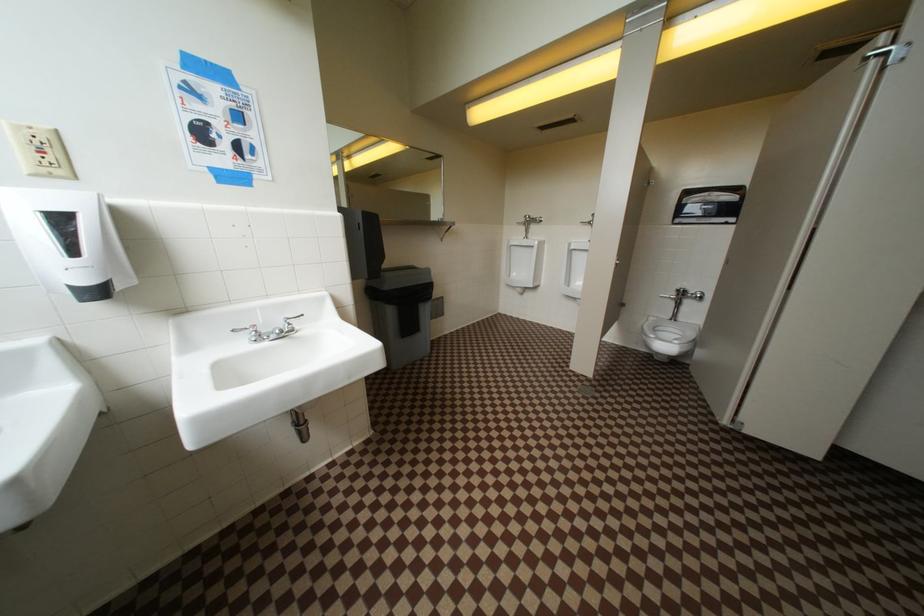
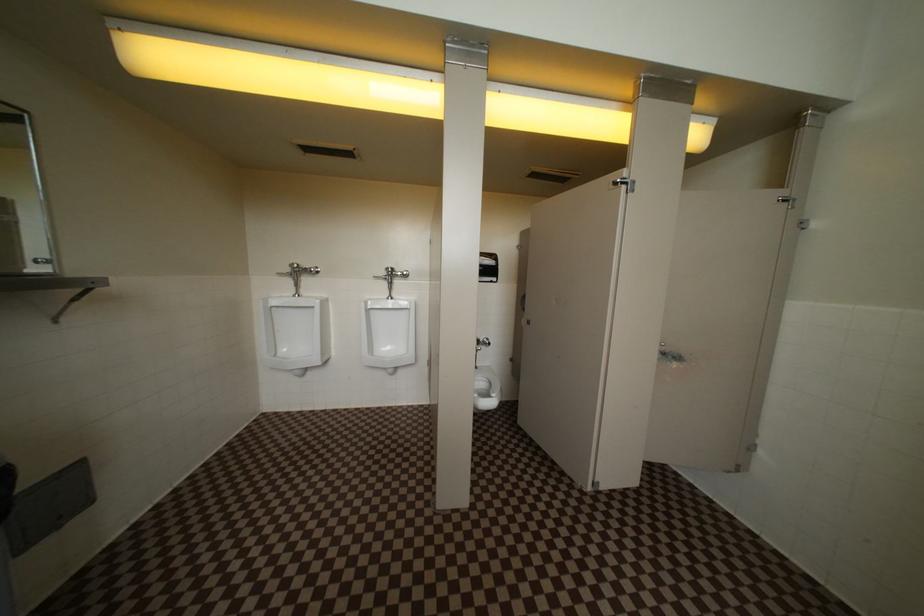
Question: Based on the continuous images, in which direction is the camera rotating? Reply with the corresponding letter.

Choices:
 (A) Left
 (B) Right
 (C) Up
 (D) Down

Answer: (B)